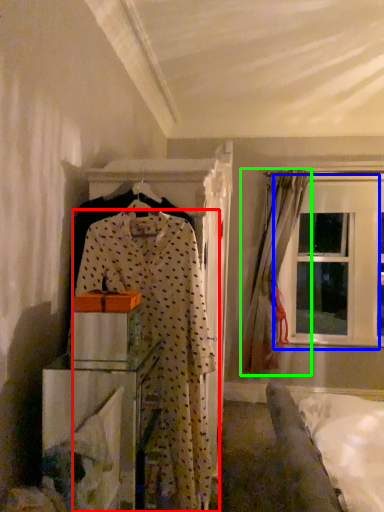
Question: Considering the real-world distances, which object is farthest from fancy dress (highlighted by a red box)? window (highlighted by a blue box) or curtain (highlighted by a green box)?

Choices:
 (A) window
 (B) curtain

Answer: (A)